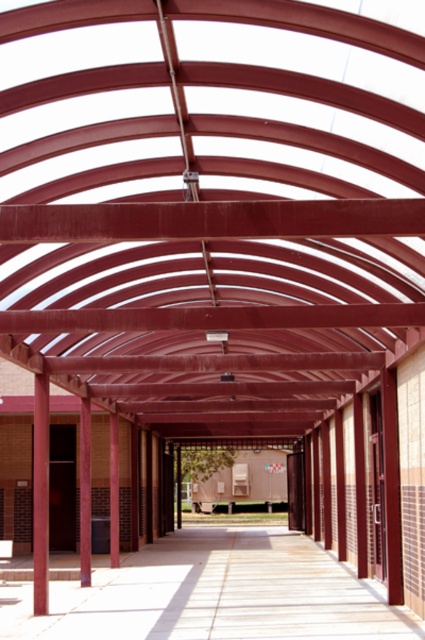
Question: Considering the relative positions of metallic red roof at center and smooth concrete walkway at center in the image provided, where is metallic red roof at center located with respect to smooth concrete walkway at center?

Choices:
 (A) right
 (B) left

Answer: (B)

Question: Which point is closer to the camera taking this photo?

Choices:
 (A) (127, 141)
 (B) (266, 538)

Answer: (A)

Question: Which object is farther from the camera taking this photo?

Choices:
 (A) smooth concrete walkway at center
 (B) metallic red roof at center

Answer: (A)

Question: Observing the image, what is the correct spatial positioning of metallic red roof at center in reference to smooth concrete walkway at center?

Choices:
 (A) below
 (B) above

Answer: (B)

Question: Does metallic red roof at center appear under smooth concrete walkway at center?

Choices:
 (A) no
 (B) yes

Answer: (A)